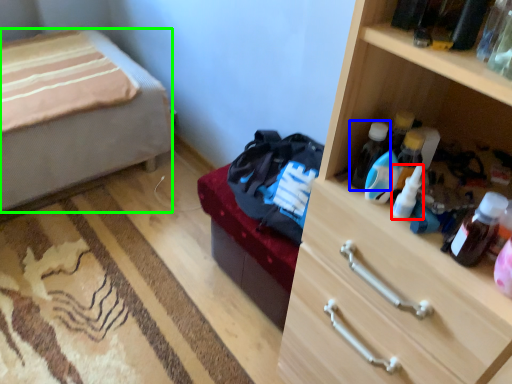
Question: Which object is the closest to the bottle (highlighted by a red box)? Choose among these: bottle (highlighted by a blue box) or desk (highlighted by a green box).

Choices:
 (A) bottle
 (B) desk

Answer: (A)